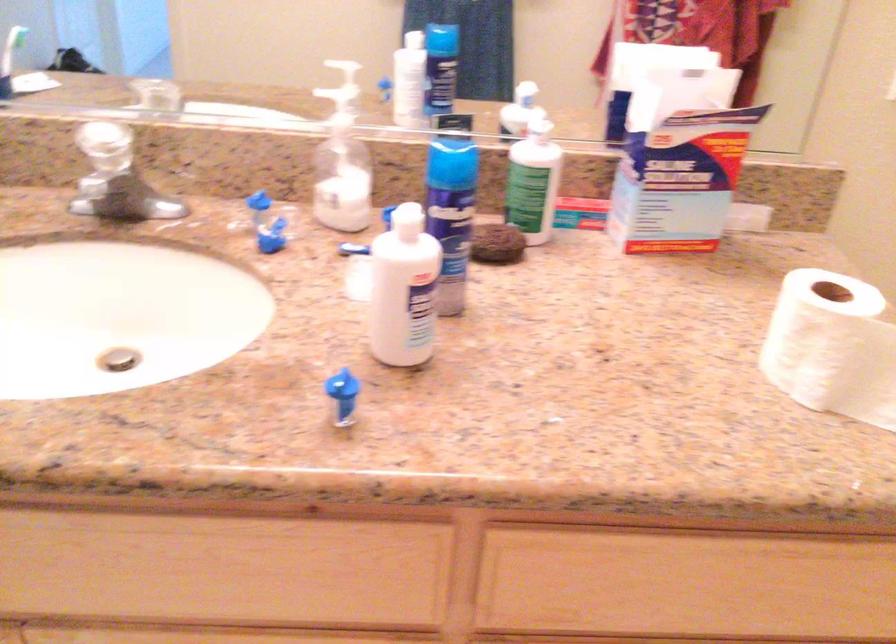
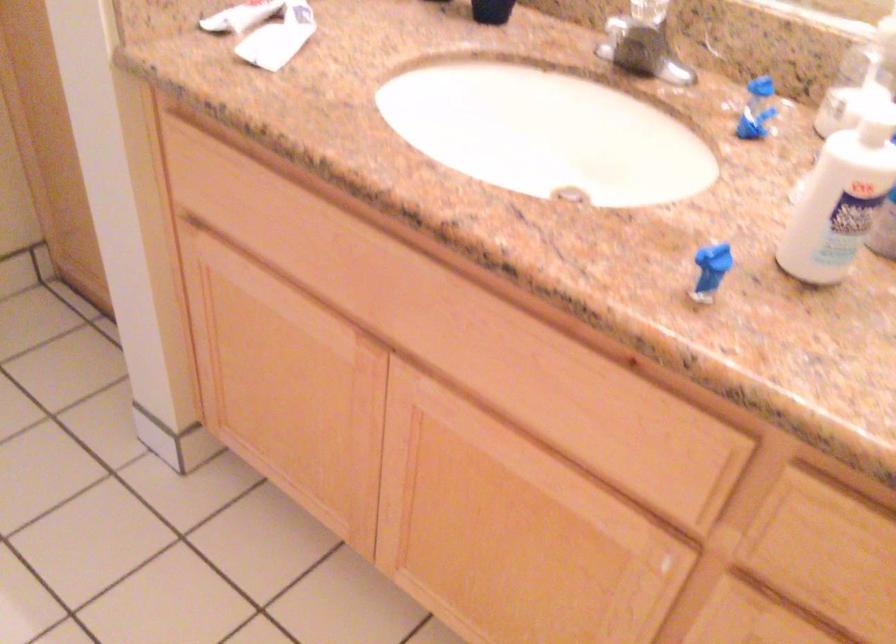
Question: How did the camera likely rotate?

Choices:
 (A) Left
 (B) Right
 (C) Up
 (D) Down

Answer: (A)